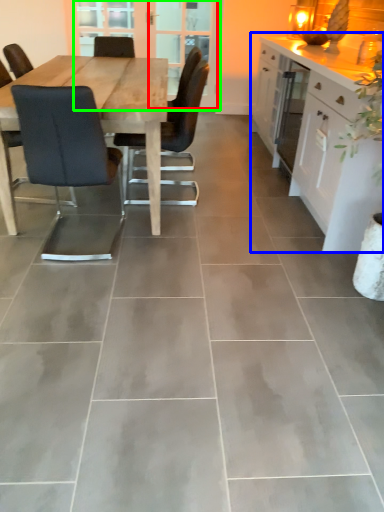
Question: Estimate the real-world distances between objects in this image. Which object is farther from screen door (highlighted by a red box), cabinetry (highlighted by a blue box) or screen door (highlighted by a green box)?

Choices:
 (A) cabinetry
 (B) screen door

Answer: (A)